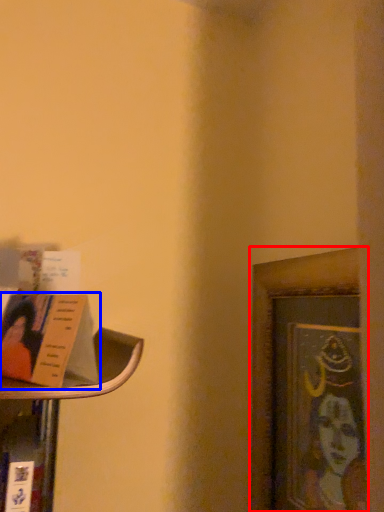
Question: Which point is closer to the camera, picture frame (highlighted by a red box) or book (highlighted by a blue box)?

Choices:
 (A) picture frame
 (B) book

Answer: (B)